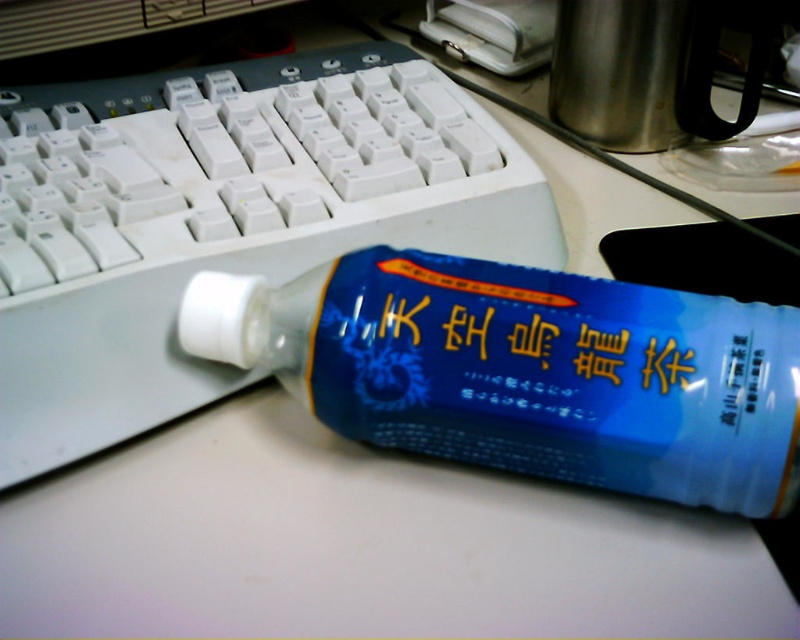
Question: Is white plastic keyboard at center to the left of blue plastic bottle at center from the viewer's perspective?

Choices:
 (A) no
 (B) yes

Answer: (B)

Question: Which of the following is the closest to the observer?

Choices:
 (A) white plastic keyboard at center
 (B) blue plastic bottle at center

Answer: (B)

Question: Does white plastic keyboard at center have a larger size compared to blue plastic bottle at center?

Choices:
 (A) no
 (B) yes

Answer: (B)

Question: Which point is farther to the camera?

Choices:
 (A) (446, 193)
 (B) (608, 410)

Answer: (A)

Question: Can you confirm if white plastic keyboard at center is positioned below blue plastic bottle at center?

Choices:
 (A) no
 (B) yes

Answer: (A)